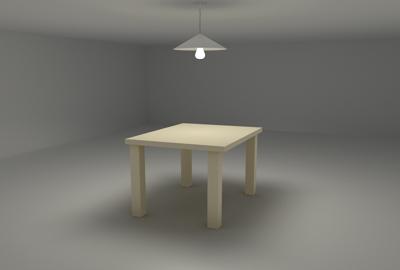
This screenshot has width=400, height=270. Find the location of `tabletop`. tabletop is located at coordinates (209, 130).